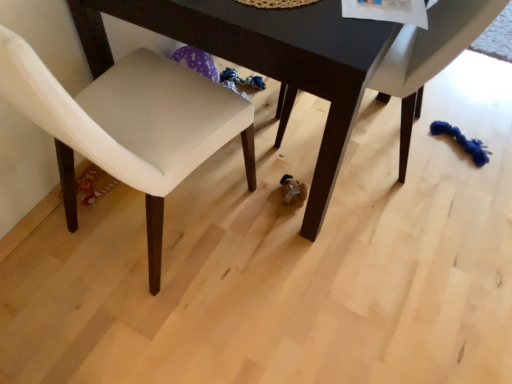
Question: Is dark wood table at center at the left side of white fabric chair at lower right, which is the 1th chair in right-to-left order?

Choices:
 (A) yes
 (B) no

Answer: (A)

Question: Is dark wood table at center next to white fabric chair at lower right, which is counted as the 2th chair, starting from the left, and touching it?

Choices:
 (A) yes
 (B) no

Answer: (B)

Question: Would you say white fabric chair at lower right, which is counted as the 2th chair, starting from the left, is part of dark wood table at center's contents?

Choices:
 (A) yes
 (B) no

Answer: (A)

Question: Is dark wood table at center taller than white fabric chair at lower right, which is the 1th chair in right-to-left order?

Choices:
 (A) yes
 (B) no

Answer: (A)

Question: Is dark wood table at center facing away from white fabric chair at lower right, which is the 1th chair in right-to-left order?

Choices:
 (A) yes
 (B) no

Answer: (B)

Question: Is dark wood table at center shorter than white fabric chair at lower right, which is the 1th chair in right-to-left order?

Choices:
 (A) no
 (B) yes

Answer: (A)

Question: From the image's perspective, is white leather chair at lower left, the 2th chair in the right-to-left sequence, under dark wood table at center?

Choices:
 (A) no
 (B) yes

Answer: (B)

Question: Can you see white leather chair at lower left, which is counted as the first chair, starting from the left, touching dark wood table at center?

Choices:
 (A) yes
 (B) no

Answer: (B)

Question: Does white leather chair at lower left, the 2th chair in the right-to-left sequence, lie behind dark wood table at center?

Choices:
 (A) no
 (B) yes

Answer: (A)

Question: Can you confirm if white leather chair at lower left, the 2th chair in the right-to-left sequence, is taller than dark wood table at center?

Choices:
 (A) no
 (B) yes

Answer: (B)

Question: Does white leather chair at lower left, the 2th chair in the right-to-left sequence, turn towards dark wood table at center?

Choices:
 (A) no
 (B) yes

Answer: (B)

Question: Can you confirm if white leather chair at lower left, the 2th chair in the right-to-left sequence, is positioned to the left of dark wood table at center?

Choices:
 (A) no
 (B) yes

Answer: (B)

Question: Considering the relative sizes of white leather chair at lower left, the 2th chair in the right-to-left sequence, and white fabric chair at lower right, which is the 1th chair in right-to-left order, in the image provided, is white leather chair at lower left, the 2th chair in the right-to-left sequence, thinner than white fabric chair at lower right, which is the 1th chair in right-to-left order,?

Choices:
 (A) yes
 (B) no

Answer: (A)